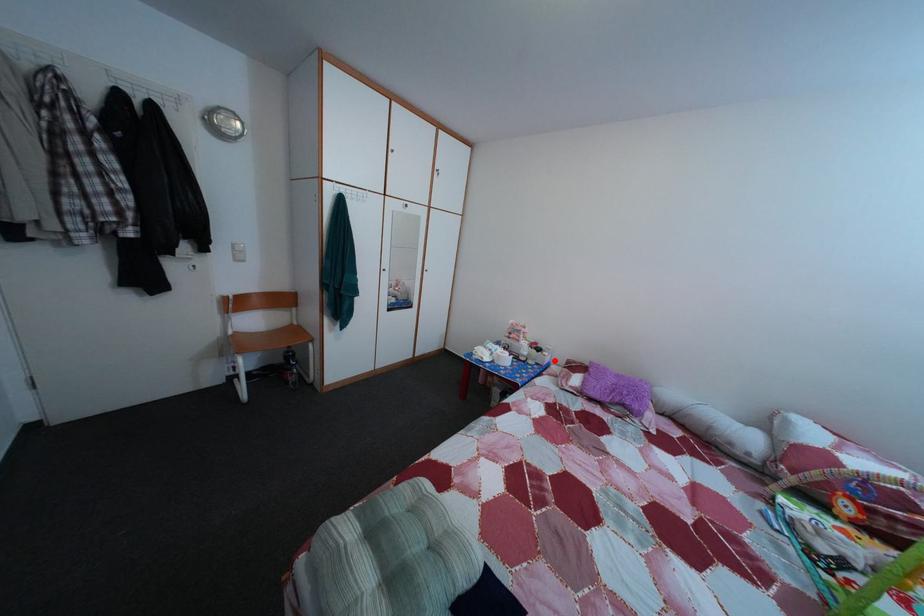
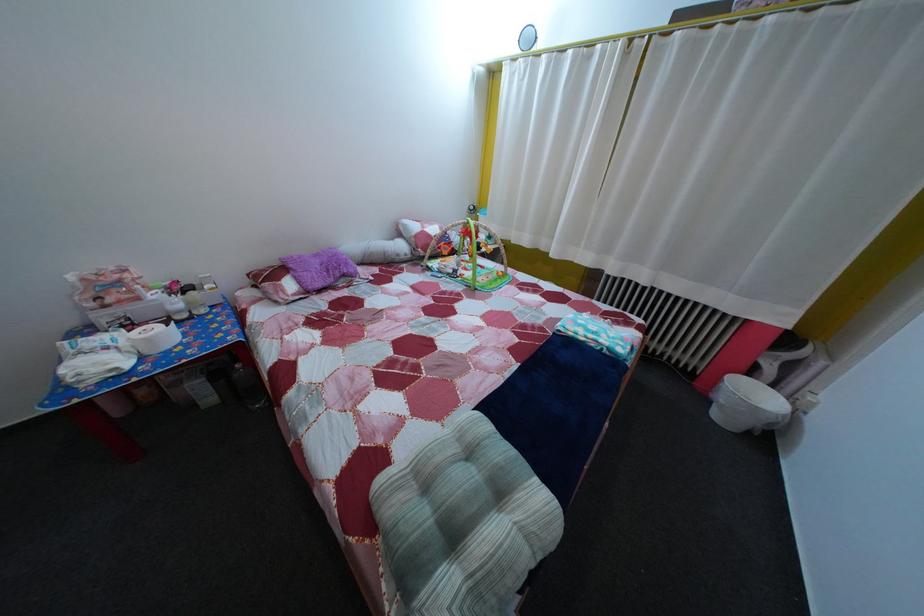
Question: I am providing you with two images of the same scene from different viewpoints. A red point is shown in image1. For the corresponding object point in image2, is it positioned nearer or farther from the camera?

Choices:
 (A) Nearer
 (B) Farther

Answer: (A)